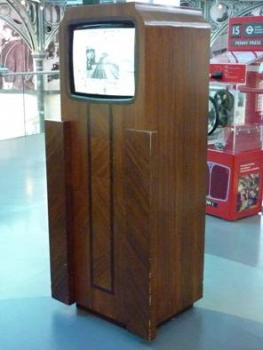
Where is `floor`? The height and width of the screenshot is (350, 263). floor is located at coordinates (22, 259).